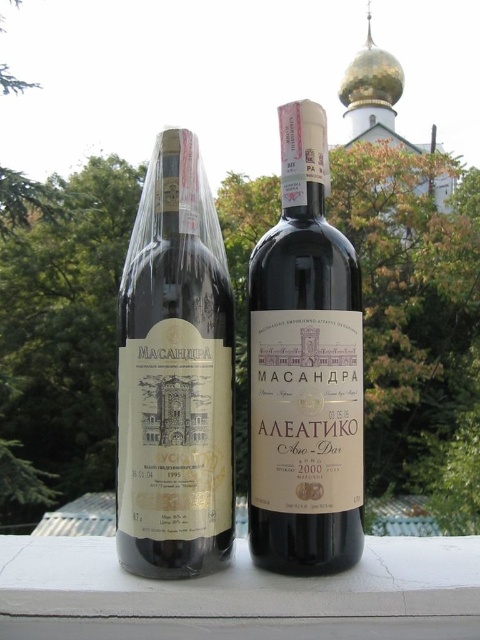
Who is lower down, matte gold foil wine bottle at center or white painted concrete at center?

Positioned lower is white painted concrete at center.

Can you confirm if matte gold foil wine bottle at center is positioned to the right of white painted concrete at center?

In fact, matte gold foil wine bottle at center is to the left of white painted concrete at center.

Locate an element on the screen. This screenshot has height=640, width=480. matte gold foil wine bottle at center is located at coordinates (175, 376).

Does matte paper wine bottle at center appear over white painted concrete at center?

Correct, matte paper wine bottle at center is located above white painted concrete at center.

Between matte paper wine bottle at center and white painted concrete at center, which one has more height?

Standing taller between the two is matte paper wine bottle at center.

This screenshot has height=640, width=480. What do you see at coordinates (304, 371) in the screenshot?
I see `matte paper wine bottle at center` at bounding box center [304, 371].

Image resolution: width=480 pixels, height=640 pixels. In order to click on matte paper wine bottle at center in this screenshot , I will do pos(304,371).

Is point (124, 342) positioned in front of point (290, 109)?

Yes, it is in front of point (290, 109).

Is matte gold foil wine bottle at center positioned before matte paper wine bottle at center?

Yes, it is in front of matte paper wine bottle at center.

The width and height of the screenshot is (480, 640). Find the location of `matte gold foil wine bottle at center`. matte gold foil wine bottle at center is located at coordinates (175, 376).

The image size is (480, 640). What are the coordinates of `matte gold foil wine bottle at center` in the screenshot? It's located at (175, 376).